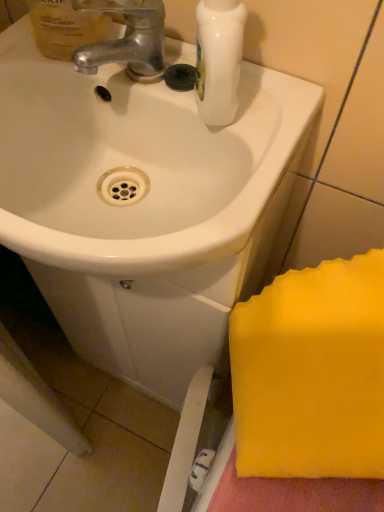
Measure the distance between silver metallic faucet at upper left and camera.

silver metallic faucet at upper left is 43.52 centimeters from camera.

Describe the element at coordinates (136, 166) in the screenshot. I see `white glossy sink at center` at that location.

The width and height of the screenshot is (384, 512). What do you see at coordinates (68, 26) in the screenshot? I see `translucent plastic mouthwash at upper left` at bounding box center [68, 26].

Find the location of a particular element. silver metallic faucet at upper left is located at coordinates (127, 39).

Is translucent plastic mouthwash at upper left positioned with its back to white glossy sink at center?

No, translucent plastic mouthwash at upper left's orientation is not away from white glossy sink at center.

Which is correct: translucent plastic mouthwash at upper left is inside white glossy sink at center, or outside of it?

translucent plastic mouthwash at upper left cannot be found inside white glossy sink at center.

Considering the relative sizes of translucent plastic mouthwash at upper left and white glossy sink at center in the image provided, is translucent plastic mouthwash at upper left shorter than white glossy sink at center?

No.

Relative to white glossy sink at center, is translucent plastic mouthwash at upper left in front or behind?

Clearly, translucent plastic mouthwash at upper left is behind white glossy sink at center.

Does point (65, 9) appear closer or farther from the camera than point (104, 4)?

Clearly, point (65, 9) is more distant from the camera than point (104, 4).

Is the depth of translucent plastic mouthwash at upper left less than that of silver metallic faucet at upper left?

Yes, it is in front of silver metallic faucet at upper left.

Measure the distance from translucent plastic mouthwash at upper left to silver metallic faucet at upper left.

translucent plastic mouthwash at upper left and silver metallic faucet at upper left are 1.24 inches apart.

This screenshot has width=384, height=512. I want to click on mouthwash above the silver metallic faucet at upper left (from the image's perspective), so click(x=68, y=26).

Can you confirm if silver metallic faucet at upper left is smaller than white glossy sink at center?

Indeed, silver metallic faucet at upper left has a smaller size compared to white glossy sink at center.

Are silver metallic faucet at upper left and white glossy sink at center making contact?

No, silver metallic faucet at upper left is not in contact with white glossy sink at center.

Which object is wider, silver metallic faucet at upper left or white glossy sink at center?

white glossy sink at center is wider.

Find the location of a particular element. This screenshot has width=384, height=512. tap that is above the white glossy sink at center (from the image's perspective) is located at coordinates (x=127, y=39).

Considering the positions of objects white glossy sink at center and silver metallic faucet at upper left in the image provided, who is in front, white glossy sink at center or silver metallic faucet at upper left?

white glossy sink at center is more forward.

Measure the distance between white glossy sink at center and silver metallic faucet at upper left.

A distance of 12.01 centimeters exists between white glossy sink at center and silver metallic faucet at upper left.

Considering the relative sizes of white glossy sink at center and silver metallic faucet at upper left in the image provided, is white glossy sink at center smaller than silver metallic faucet at upper left?

No.

You are a GUI agent. You are given a task and a screenshot of the screen. Output one action in this format:
    pyautogui.click(x=<x>, y=<y>)
    Task: Click on the mouthwash lying above the white glossy sink at center (from the image's perspective)
    Image resolution: width=384 pixels, height=512 pixels.
    Given the screenshot: What is the action you would take?
    pyautogui.click(x=68, y=26)

Considering the relative sizes of white glossy sink at center and translucent plastic mouthwash at upper left in the image provided, is white glossy sink at center wider than translucent plastic mouthwash at upper left?

Indeed, white glossy sink at center has a greater width compared to translucent plastic mouthwash at upper left.

Can you tell me how much white glossy sink at center and translucent plastic mouthwash at upper left differ in facing direction?

0.00147 degrees separate the facing orientations of white glossy sink at center and translucent plastic mouthwash at upper left.

From the picture: Does white glossy sink at center come in front of translucent plastic mouthwash at upper left?

That is True.

Is silver metallic faucet at upper left positioned with its back to translucent plastic mouthwash at upper left?

No, silver metallic faucet at upper left's orientation is not away from translucent plastic mouthwash at upper left.

Is silver metallic faucet at upper left at the left side of translucent plastic mouthwash at upper left?

In fact, silver metallic faucet at upper left is to the right of translucent plastic mouthwash at upper left.

Considering the sizes of silver metallic faucet at upper left and translucent plastic mouthwash at upper left in the image, is silver metallic faucet at upper left taller or shorter than translucent plastic mouthwash at upper left?

Clearly, silver metallic faucet at upper left is shorter compared to translucent plastic mouthwash at upper left.

Find the location of `sink in front of the translucent plastic mouthwash at upper left`. sink in front of the translucent plastic mouthwash at upper left is located at coordinates click(x=136, y=166).

Where is `mouthwash on the left of the silver metallic faucet at upper left`? The image size is (384, 512). mouthwash on the left of the silver metallic faucet at upper left is located at coordinates (68, 26).

From the image, which object appears to be nearer to translucent plastic mouthwash at upper left, silver metallic faucet at upper left or white glossy sink at center?

Among the two, silver metallic faucet at upper left is located nearer to translucent plastic mouthwash at upper left.

Estimate the real-world distances between objects in this image. Which object is closer to white glossy sink at center, silver metallic faucet at upper left or translucent plastic mouthwash at upper left?

silver metallic faucet at upper left lies closer to white glossy sink at center than the other object.

Based on their spatial positions, is translucent plastic mouthwash at upper left or white glossy sink at center further from silver metallic faucet at upper left?

white glossy sink at center is further to silver metallic faucet at upper left.

Estimate the real-world distances between objects in this image. Which object is closer to translucent plastic mouthwash at upper left, white glossy sink at center or silver metallic faucet at upper left?

Based on the image, silver metallic faucet at upper left appears to be nearer to translucent plastic mouthwash at upper left.

When comparing their distances from silver metallic faucet at upper left, does white glossy sink at center or translucent plastic mouthwash at upper left seem further?

white glossy sink at center.

Estimate the real-world distances between objects in this image. Which object is closer to white glossy sink at center, translucent plastic mouthwash at upper left or silver metallic faucet at upper left?

silver metallic faucet at upper left is positioned closer to the anchor white glossy sink at center.

Image resolution: width=384 pixels, height=512 pixels. In order to click on tap between translucent plastic mouthwash at upper left and white glossy sink at center from top to bottom in this screenshot , I will do `click(127, 39)`.